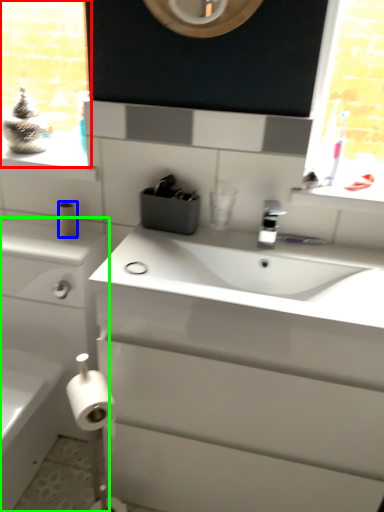
Question: Which object is positioned closest to window frame (highlighted by a red box)? Select from toilet paper (highlighted by a blue box) and bathroom cabinet (highlighted by a green box).

Choices:
 (A) toilet paper
 (B) bathroom cabinet

Answer: (B)